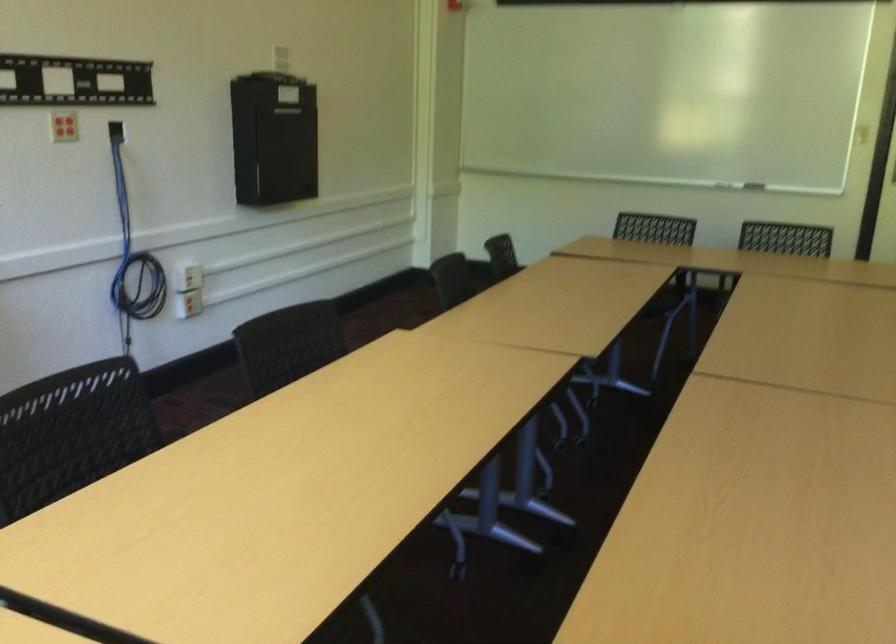
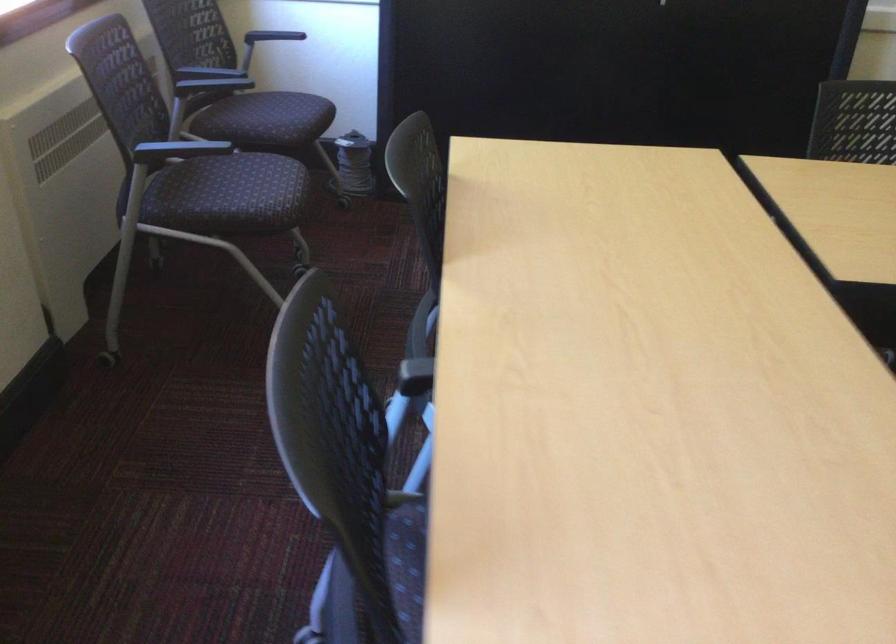
How did the camera likely rotate?

The camera's rotation is toward left-down.